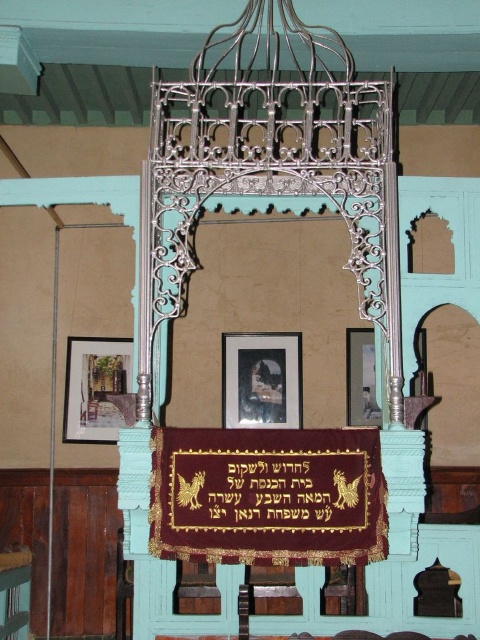
Question: Which object appears farthest from the camera in this image?

Choices:
 (A) matte wooden picture frame at lower left
 (B) metallic frame at center

Answer: (A)

Question: Which is nearer to the metallic frame at center?

Choices:
 (A) goldmaterial/texturescroll at center
 (B) matte wooden picture frame at lower left

Answer: (B)

Question: Does goldmaterial/texturescroll at center appear on the right side of matte black picture frame at center?

Choices:
 (A) no
 (B) yes

Answer: (B)

Question: Which point is farther to the camera?

Choices:
 (A) (227, 353)
 (B) (361, 392)

Answer: (A)

Question: Does goldmaterial/texturescroll at center appear over metallic frame at center?

Choices:
 (A) no
 (B) yes

Answer: (A)

Question: Is matte black picture frame at center to the right of metallic frame at center from the viewer's perspective?

Choices:
 (A) yes
 (B) no

Answer: (B)